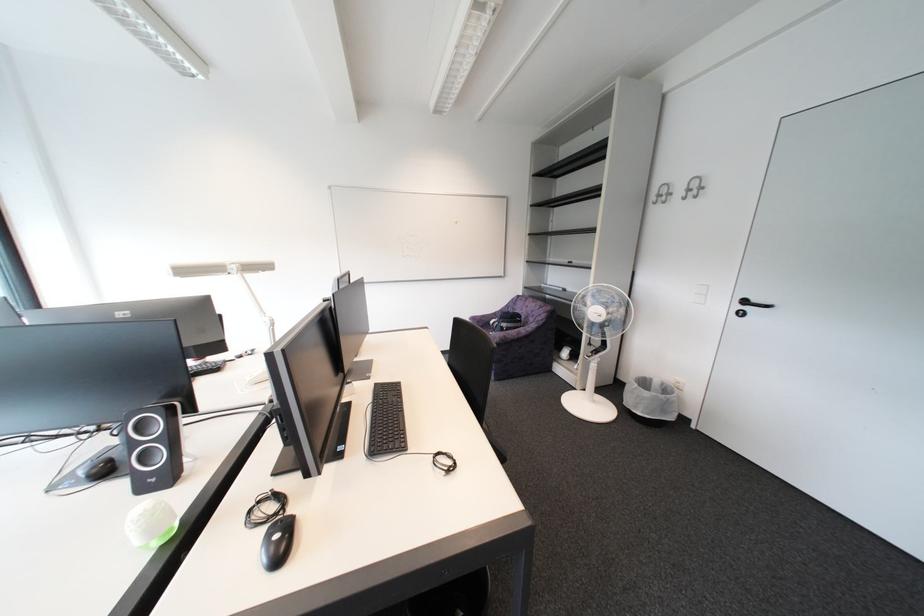
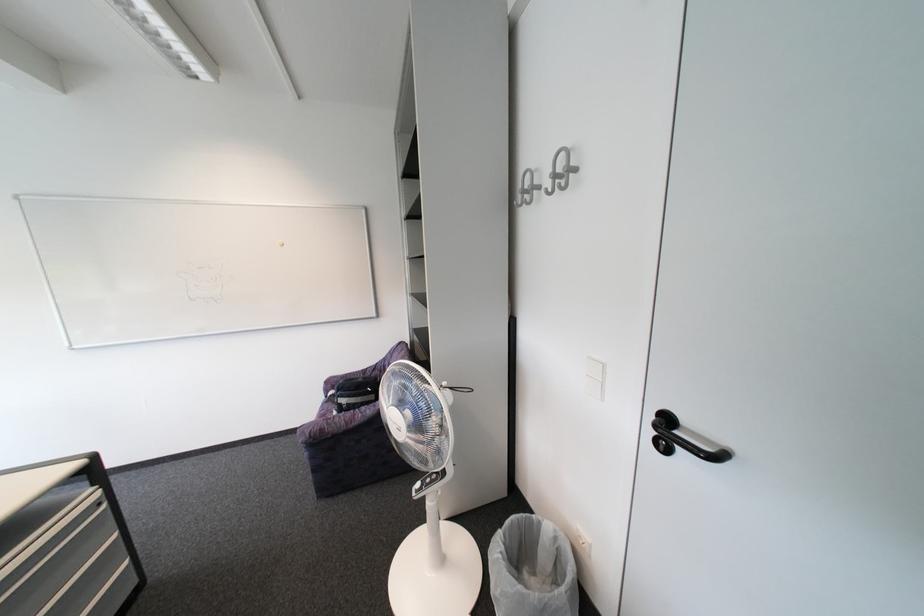
In a continuous first-person perspective shot, in which direction is the camera moving?

The cameraman moved toward right, forward.